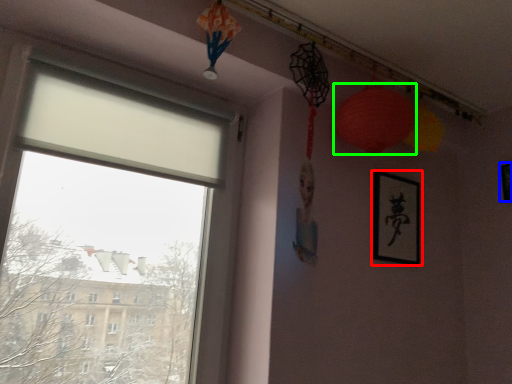
Question: Based on their relative distances, which object is nearer to picture frame (highlighted by a red box)? Choose from picture frame (highlighted by a blue box) and lantern (highlighted by a green box).

Choices:
 (A) picture frame
 (B) lantern

Answer: (B)